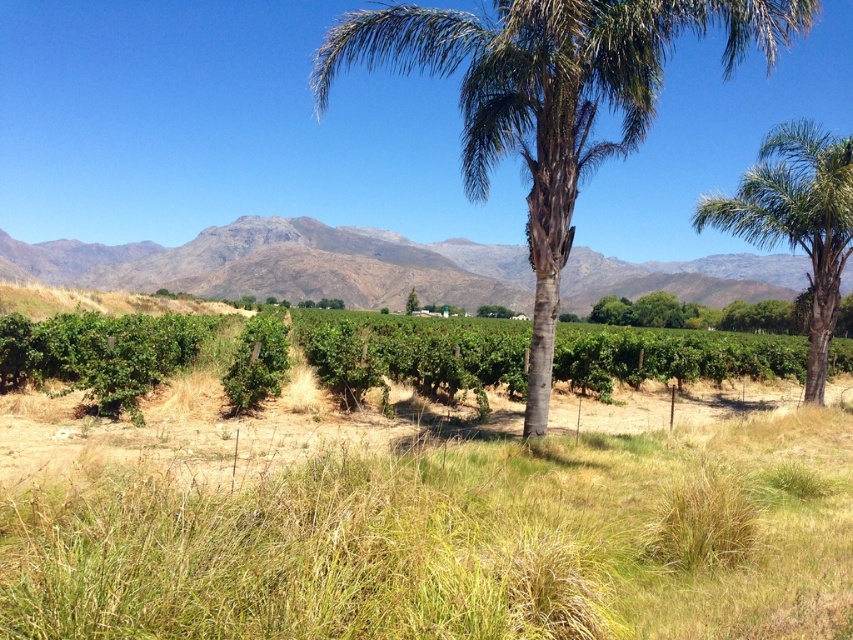
Does green textured palm tree at center have a greater width compared to gray rocky mountain at center?

No, green textured palm tree at center is not wider than gray rocky mountain at center.

Does green textured palm tree at center appear under gray rocky mountain at center?

Actually, green textured palm tree at center is above gray rocky mountain at center.

Locate an element on the screen. The width and height of the screenshot is (853, 640). green textured palm tree at center is located at coordinates (549, 99).

How distant is green grass at center from green textured palm tree at center?

A distance of 7.91 meters exists between green grass at center and green textured palm tree at center.

Consider the image. Does green grass at center have a lesser height compared to green textured palm tree at center?

Yes, green grass at center is shorter than green textured palm tree at center.

The width and height of the screenshot is (853, 640). Find the location of `green grass at center`. green grass at center is located at coordinates (454, 541).

Can you confirm if green leafy hedge at center is bigger than green leafy palm tree at center?

Actually, green leafy hedge at center might be smaller than green leafy palm tree at center.

Which is behind, point (267, 352) or point (722, 196)?

Point (722, 196)

Find the location of a particular element. Image resolution: width=853 pixels, height=640 pixels. green leafy hedge at center is located at coordinates (410, 353).